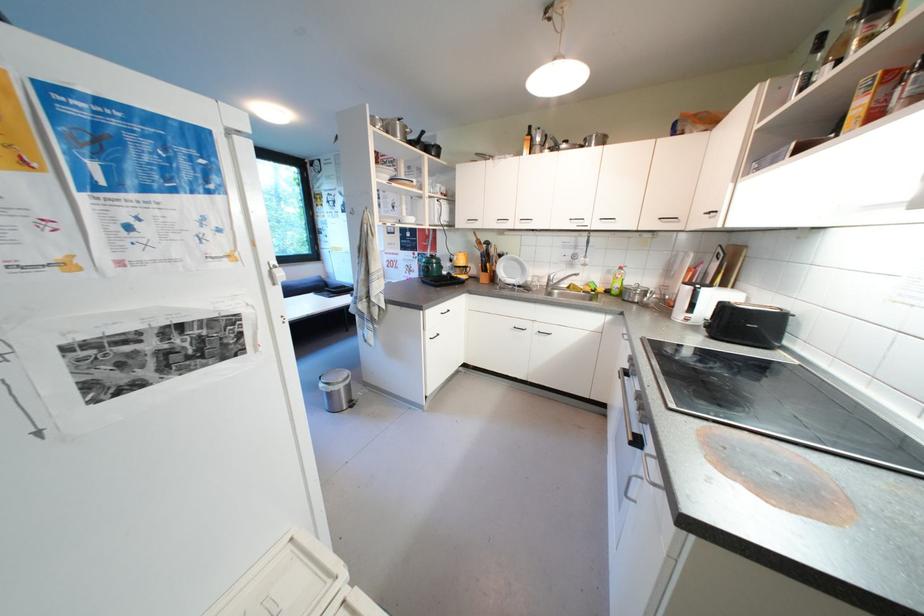
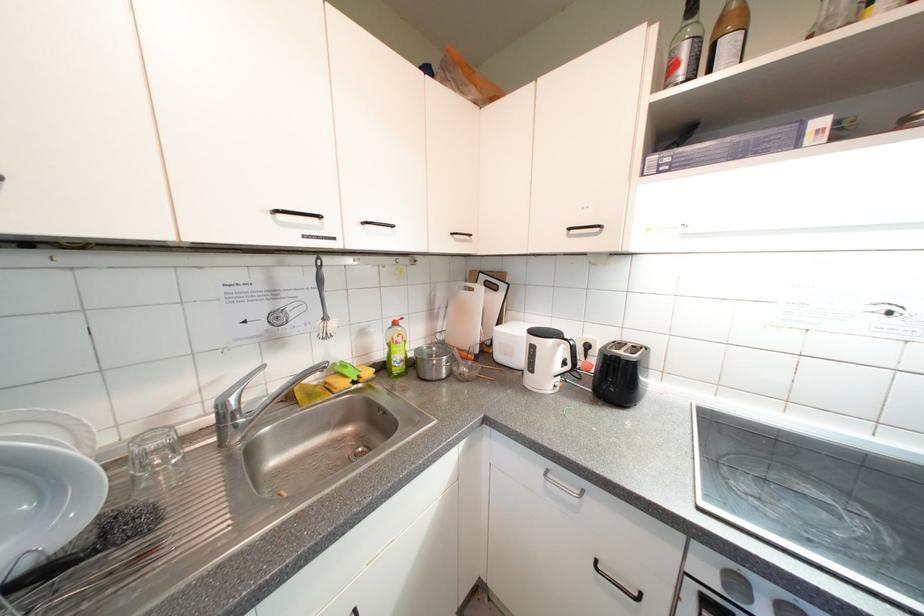
In the second image, find the point that corresponds to pixel 556 282 in the first image.

(233, 419)